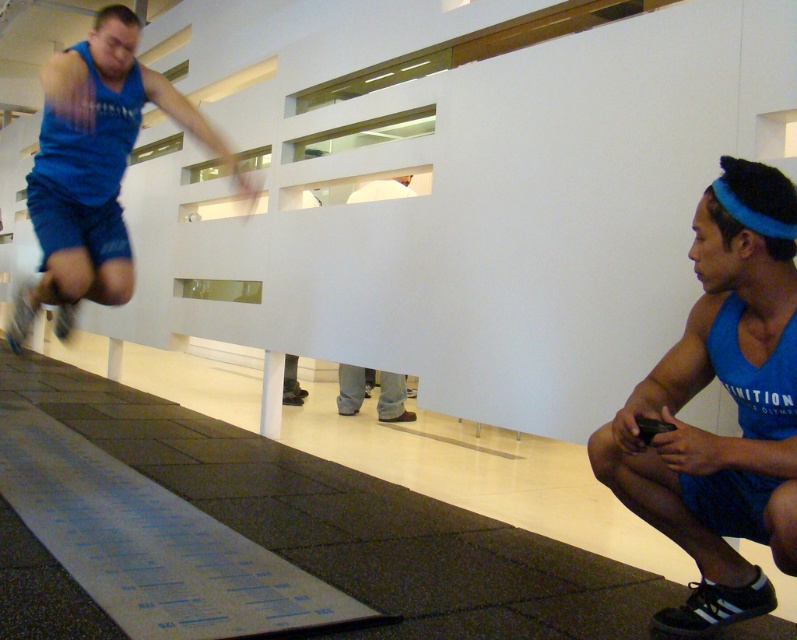
This screenshot has width=797, height=640. Describe the element at coordinates (728, 392) in the screenshot. I see `blue fabric tank top at lower right` at that location.

This screenshot has width=797, height=640. Identify the location of blue fabric tank top at lower right. (728, 392).

You are a GUI agent. You are given a task and a screenshot of the screen. Output one action in this format:
    pyautogui.click(x=<x>, y=<y>)
    Task: Click on the blue fabric tank top at lower right
    This screenshot has height=640, width=797.
    Given the screenshot: What is the action you would take?
    pyautogui.click(x=728, y=392)

Measure the distance from blue fabric tank top at lower right to gray fabric pants at center.

They are 11.62 feet apart.

Describe the element at coordinates (728, 392) in the screenshot. The width and height of the screenshot is (797, 640). I see `blue fabric tank top at lower right` at that location.

The width and height of the screenshot is (797, 640). I want to click on blue fabric tank top at lower right, so click(728, 392).

Between blue fabric tank top at left and gray fabric pants at center, which one is positioned lower?

gray fabric pants at center is lower down.

I want to click on blue fabric tank top at left, so click(x=93, y=170).

Measure the distance between blue fabric tank top at left and camera.

A distance of 7.87 feet exists between blue fabric tank top at left and camera.

I want to click on blue fabric tank top at left, so [x=93, y=170].